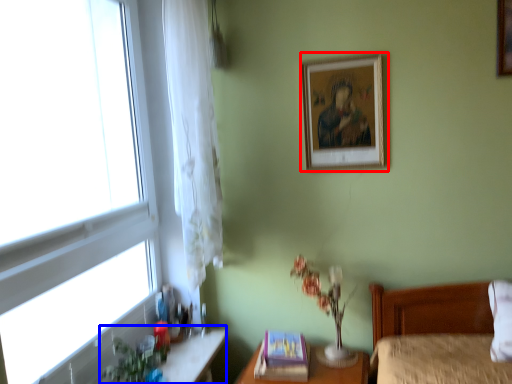
Question: Which point is closer to the camera, picture frame (highlighted by a red box) or vanity (highlighted by a blue box)?

Choices:
 (A) picture frame
 (B) vanity

Answer: (B)